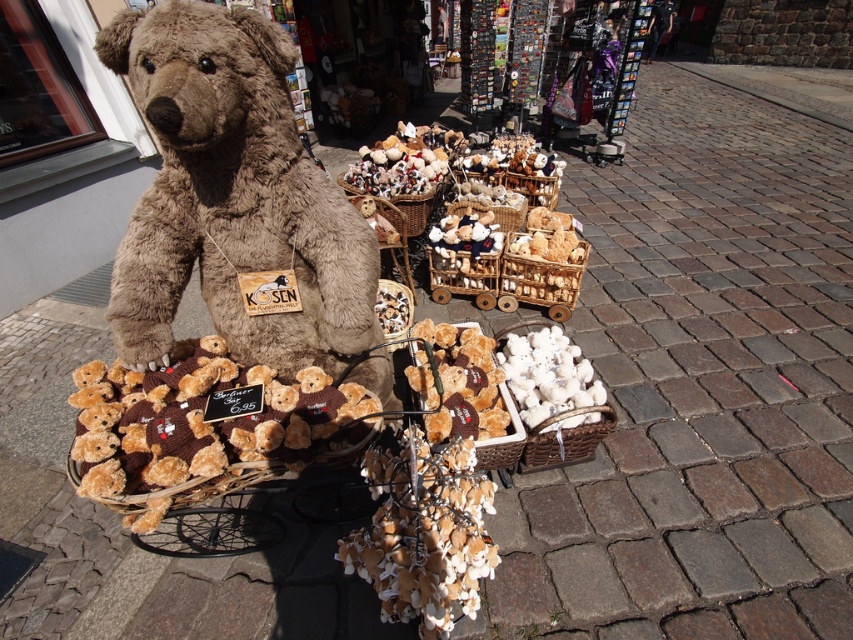
Question: Does soft brown teddy bear at center have a larger size compared to white wicker basket at lower right?

Choices:
 (A) yes
 (B) no

Answer: (A)

Question: Which object is the farthest from the knitted brown teddy bear at center?

Choices:
 (A) woven brown basket at center
 (B) brown wicker basket at center
 (C) knitted brown teddy bear basket at center
 (D) white wicker basket at lower right

Answer: (B)

Question: Can you confirm if soft brown teddy bear at center is thinner than shiny metallic basket at center?

Choices:
 (A) no
 (B) yes

Answer: (A)

Question: Which point is closer to the camera?

Choices:
 (A) (325, 180)
 (B) (535, 180)

Answer: (A)

Question: Which object is the farthest from the shiny metallic basket at center?

Choices:
 (A) brown woven basket at center
 (B) white fabric basket at center

Answer: (A)

Question: Is soft brown teddy bear at center to the right of white wicker basket at center from the viewer's perspective?

Choices:
 (A) no
 (B) yes

Answer: (A)